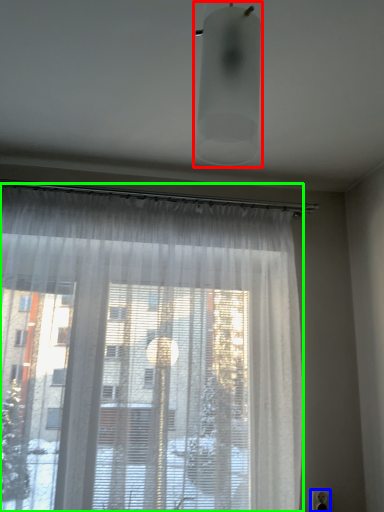
Question: Which object is positioned closest to light fixture (highlighted by a red box)? Select from electric outlet (highlighted by a blue box) and curtain (highlighted by a green box).

Choices:
 (A) electric outlet
 (B) curtain

Answer: (B)